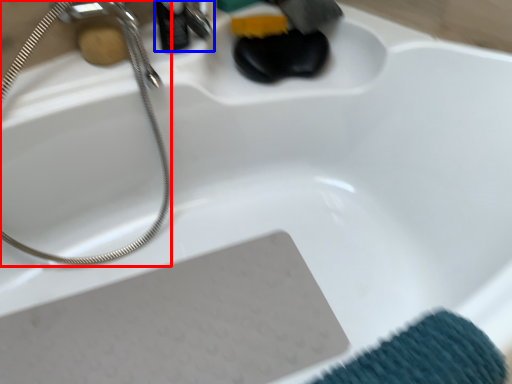
Question: Among these objects, which one is farthest to the camera, shower (highlighted by a red box) or faucet (highlighted by a blue box)?

Choices:
 (A) shower
 (B) faucet

Answer: (B)